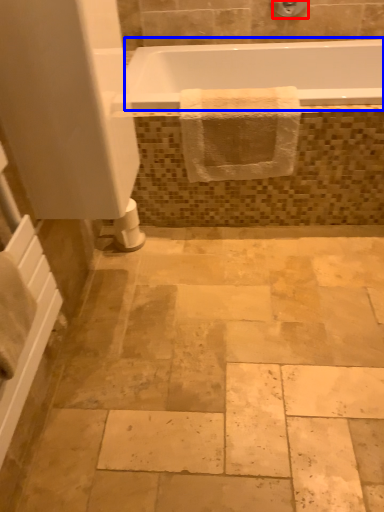
Question: Which object is further to the camera taking this photo, shower (highlighted by a red box) or bathtub (highlighted by a blue box)?

Choices:
 (A) shower
 (B) bathtub

Answer: (A)